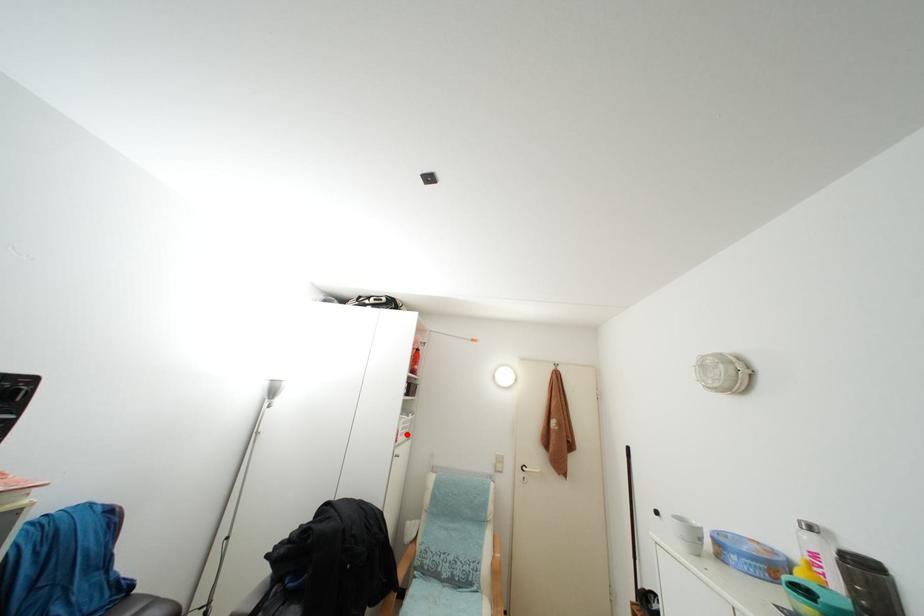
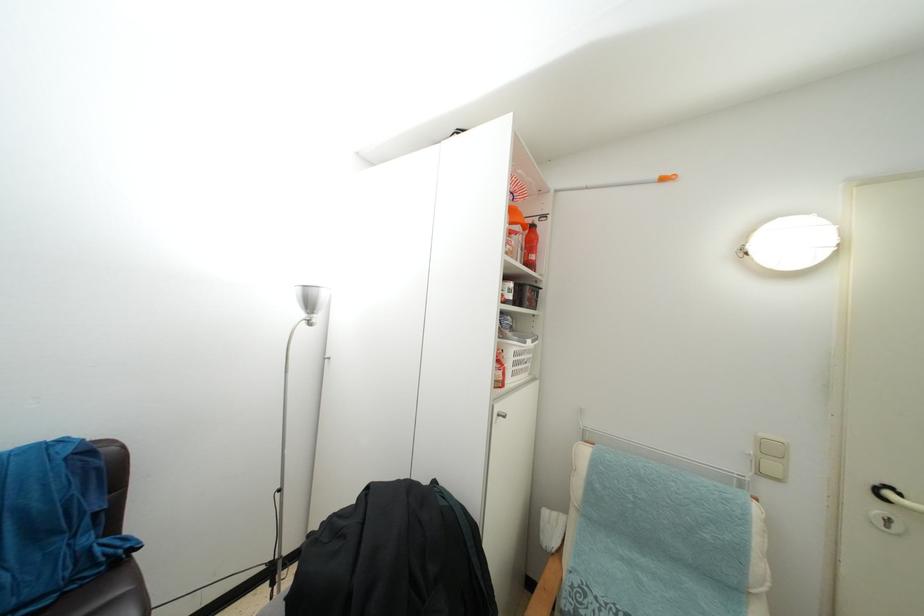
Question: A red point is marked in image1. In image2, is the corresponding 3D point closer to the camera or farther? Reply with the corresponding letter.

Choices:
 (A) The corresponding 3D point is closer.
 (B) The corresponding 3D point is farther.

Answer: (A)